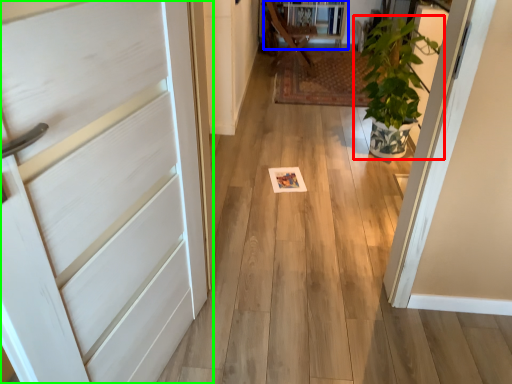
Question: Which object is positioned closest to houseplant (highlighted by a red box)? Select from bookshelf (highlighted by a blue box) and door (highlighted by a green box).

Choices:
 (A) bookshelf
 (B) door

Answer: (A)